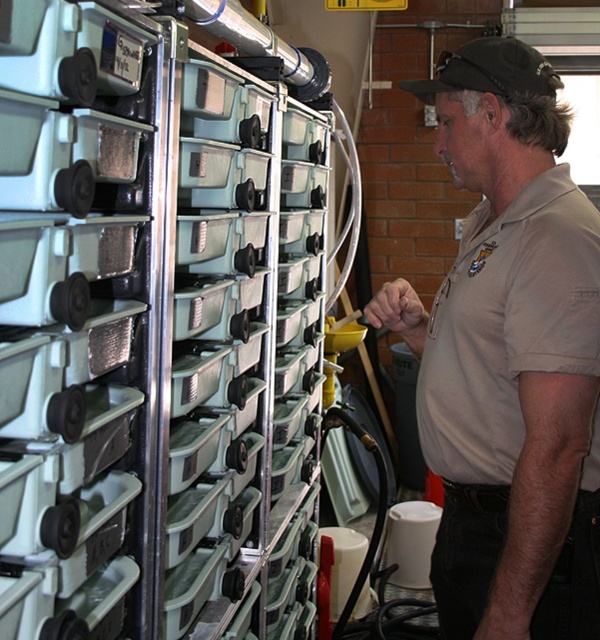
From the picture: You are observing a worker in a workshop. The worker is wearing a beige uniform at center and has a black fabric baseball cap at upper center. Which item is taller?

The beige uniform at center is taller than the black fabric baseball cap at upper center.

Where is the matte plastic drawers at center located in the image?

The matte plastic drawers at center are located at point 0.512 on the x axis and 0.258 on the y axis.